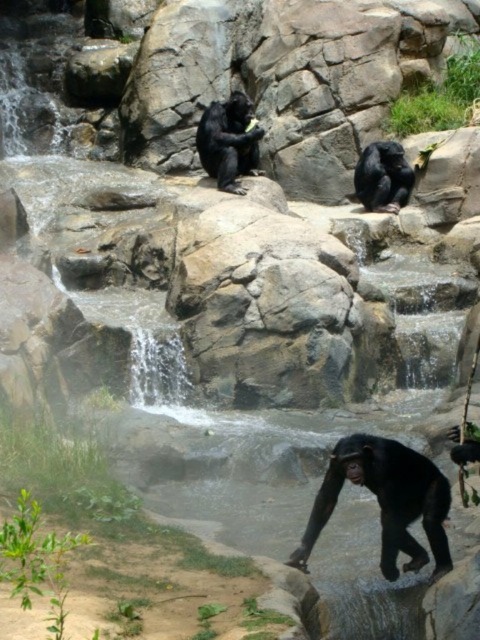
Between point (211, 145) and point (384, 163), which one is positioned behind?

Positioned behind is point (384, 163).

What do you see at coordinates (228, 141) in the screenshot? Image resolution: width=480 pixels, height=640 pixels. I see `black matte monkey at center` at bounding box center [228, 141].

Identify the location of black matte monkey at center. (228, 141).

Which is in front, point (396, 573) or point (228, 132)?

Point (396, 573) is in front.

Based on the photo, who is more distant from viewer, (x=440, y=550) or (x=216, y=168)?

Point (x=216, y=168)

Where is `black glossy monkey at lower center`? The height and width of the screenshot is (640, 480). black glossy monkey at lower center is located at coordinates (385, 500).

Which is above, black glossy monkey at lower center or black matte monkey at upper center?

Positioned higher is black matte monkey at upper center.

Who is more distant from viewer, (386, 508) or (408, 193)?

The point (408, 193) is more distant.

Image resolution: width=480 pixels, height=640 pixels. What are the coordinates of `black glossy monkey at lower center` in the screenshot? It's located at (385, 500).